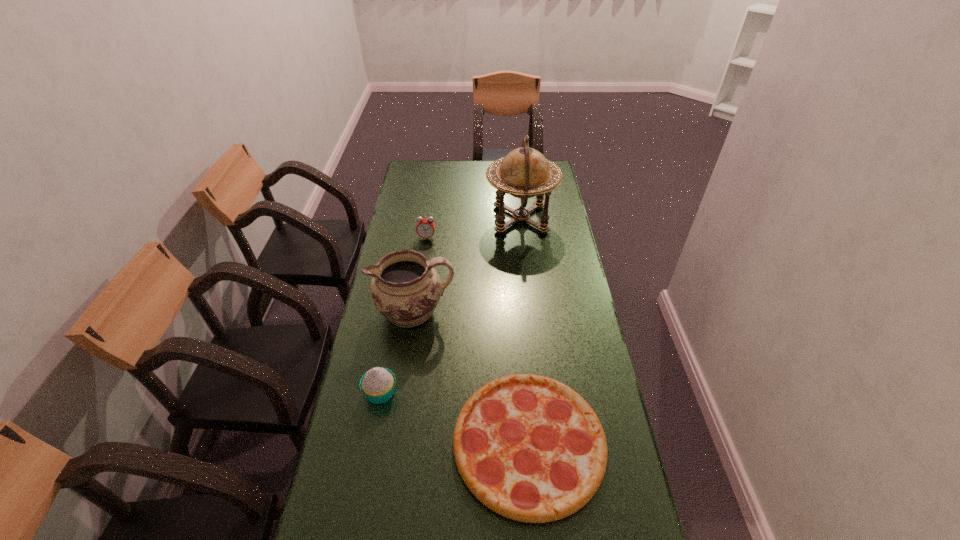
I want to click on unoccupied area between the shortest object and the third nearest object, so click(x=471, y=377).

Locate an element on the screen. vacant space that is in between the alarm clock and the shortest object is located at coordinates 478,341.

Locate an element on the screen. vacant region between the fourth shortest object and the cupcake is located at coordinates (397, 352).

Where is `vacant space in between the shortest object and the alarm clock`? This screenshot has height=540, width=960. vacant space in between the shortest object and the alarm clock is located at coordinates (478, 341).

The height and width of the screenshot is (540, 960). What are the coordinates of `free spot between the cupcake and the shortest object` in the screenshot? It's located at (455, 418).

Where is `free space between the tallest object and the cupcake`? This screenshot has width=960, height=540. free space between the tallest object and the cupcake is located at coordinates (450, 306).

You are a GUI agent. You are given a task and a screenshot of the screen. Output one action in this format:
    pyautogui.click(x=<x>, y=<y>)
    Task: Click on the object that stands as the second closest to the globe
    This screenshot has width=960, height=540.
    Given the screenshot: What is the action you would take?
    pyautogui.click(x=405, y=288)

I want to click on object that stands as the second closest to the fourth shortest object, so click(528, 447).

This screenshot has width=960, height=540. In order to click on vacant space that satisfies the following two spatial constraints: 1. on the front-facing side of the globe; 2. on the front-facing side of the alarm clock in this screenshot , I will do `click(523, 238)`.

In order to click on blank area in the image that satisfies the following two spatial constraints: 1. on the front-facing side of the alarm clock; 2. on the spout of the fourth shortest object in this screenshot , I will do `click(416, 312)`.